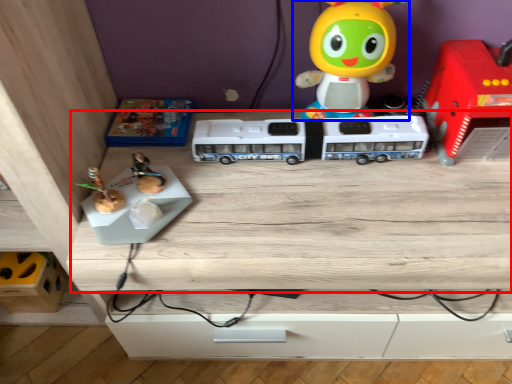
Question: Which point is closer to the camera, table (highlighted by a red box) or toy (highlighted by a blue box)?

Choices:
 (A) table
 (B) toy

Answer: (A)